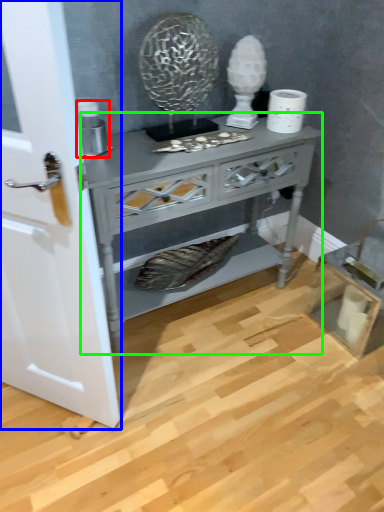
Question: Which object is the closest to the appliance (highlighted by a red box)? Choose among these: door (highlighted by a blue box) or nightstand (highlighted by a green box).

Choices:
 (A) door
 (B) nightstand

Answer: (B)